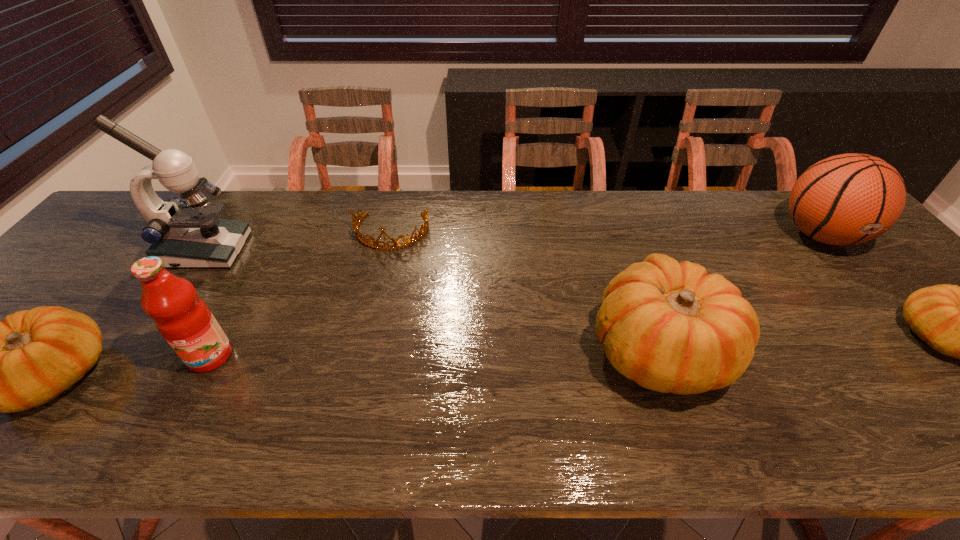
At what (x,y) coordinates should I click in order to perform the action: click on vacant region that satisfies the following two spatial constraints: 1. on the front-facing side of the third object from right to left; 2. on the left side of the fourth object from right to left. Please return your answer as a coordinate pair (x, y). This screenshot has height=540, width=960. Looking at the image, I should click on (365, 349).

I want to click on free space that satisfies the following two spatial constraints: 1. on the back side of the fourth shortest object; 2. at the eyepiece of the tallest object, so click(625, 251).